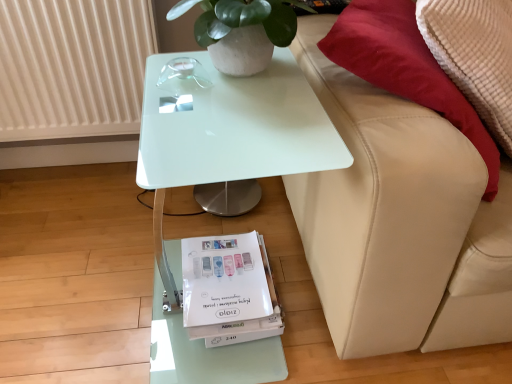
Question: Considering the relative sizes of white glossy table at center and beige leather couch at right in the image provided, is white glossy table at center bigger than beige leather couch at right?

Choices:
 (A) no
 (B) yes

Answer: (A)

Question: Does white glossy table at center come behind beige leather couch at right?

Choices:
 (A) no
 (B) yes

Answer: (B)

Question: From the image's perspective, is white glossy table at center on top of beige leather couch at right?

Choices:
 (A) no
 (B) yes

Answer: (A)

Question: From a real-world perspective, is white glossy table at center physically above beige leather couch at right?

Choices:
 (A) yes
 (B) no

Answer: (B)

Question: Does white glossy table at center have a greater height compared to beige leather couch at right?

Choices:
 (A) yes
 (B) no

Answer: (B)

Question: Is white paper magazine at lower center situated inside white ribbed radiator at upper left or outside?

Choices:
 (A) inside
 (B) outside

Answer: (B)

Question: From a real-world perspective, relative to white ribbed radiator at upper left, is white paper magazine at lower center vertically above or below?

Choices:
 (A) above
 (B) below

Answer: (B)

Question: Considering the positions of white paper magazine at lower center and white ribbed radiator at upper left in the image, is white paper magazine at lower center wider or thinner than white ribbed radiator at upper left?

Choices:
 (A) thin
 (B) wide

Answer: (B)

Question: From their relative heights in the image, would you say white paper magazine at lower center is taller or shorter than white ribbed radiator at upper left?

Choices:
 (A) short
 (B) tall

Answer: (A)

Question: Is beige leather couch at right inside or outside of white glossy table at center?

Choices:
 (A) inside
 (B) outside

Answer: (B)

Question: Based on their sizes in the image, would you say beige leather couch at right is bigger or smaller than white glossy table at center?

Choices:
 (A) small
 (B) big

Answer: (B)

Question: From the image's perspective, is beige leather couch at right above or below white glossy table at center?

Choices:
 (A) above
 (B) below

Answer: (A)

Question: Is point (352, 145) closer or farther from the camera than point (183, 170)?

Choices:
 (A) farther
 (B) closer

Answer: (A)

Question: From the image's perspective, is white ribbed radiator at upper left located above or below white paper magazine at lower center?

Choices:
 (A) above
 (B) below

Answer: (A)

Question: In the image, is white ribbed radiator at upper left positioned in front of or behind white paper magazine at lower center?

Choices:
 (A) behind
 (B) front

Answer: (A)